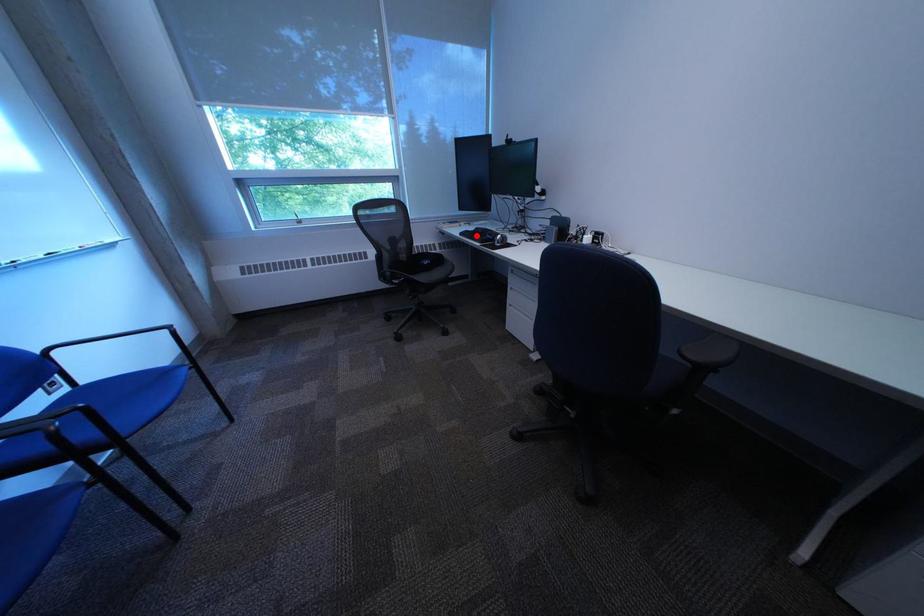
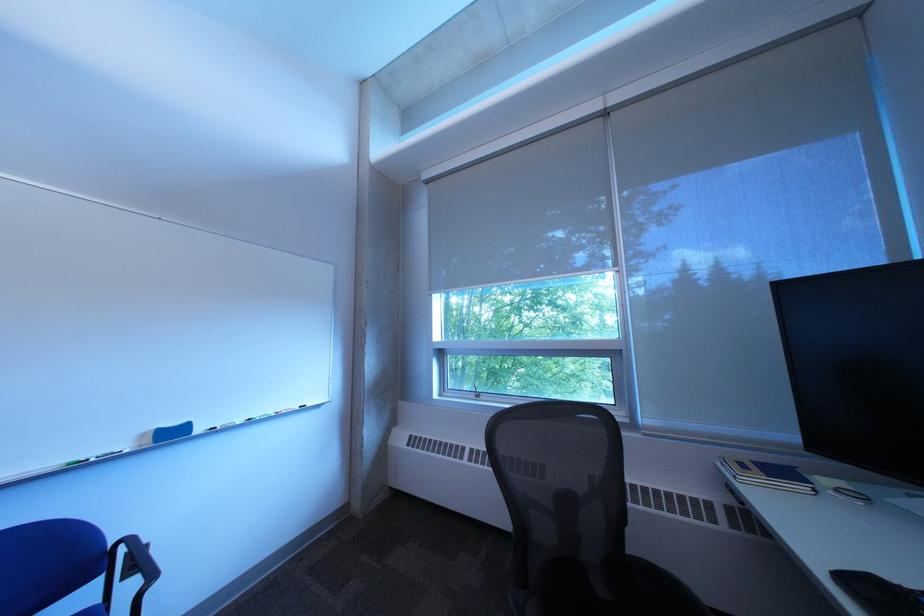
Question: I am providing you with two images of the same scene from different viewpoints. In image1, a red point is highlighted. Considering the same 3D point in image2, which of the following is correct?

Choices:
 (A) It is closer
 (B) It is farther

Answer: (B)